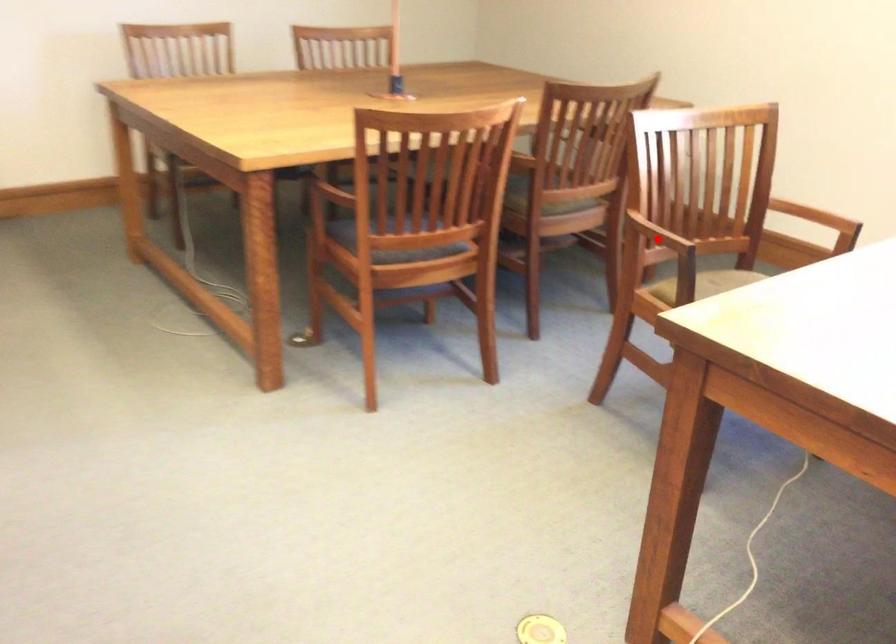
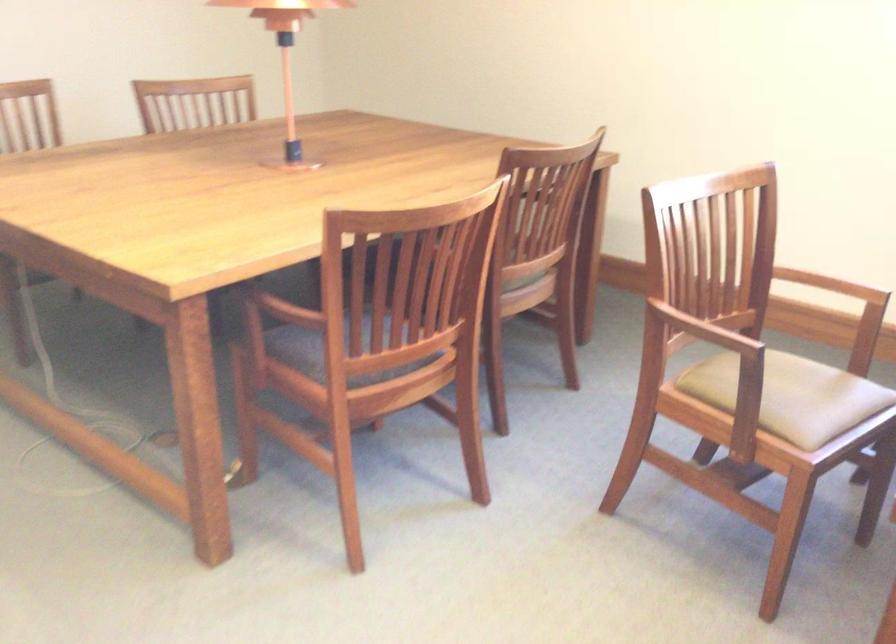
In the second image, find the point that corresponds to the highlighted location in the first image.

(712, 334)